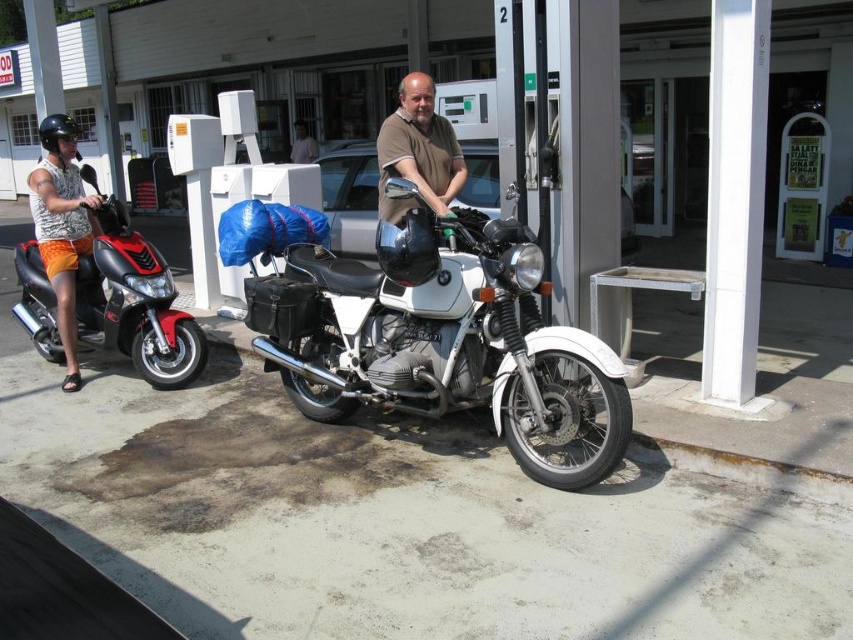
Question: Does shiny red scooter at left have a smaller size compared to brown matte shirt at center?

Choices:
 (A) yes
 (B) no

Answer: (B)

Question: Which is nearer to the light pink fabric shirt at center?

Choices:
 (A) white matte motorcycle at center
 (B) shiny red scooter at left

Answer: (B)

Question: Does brown matte shirt at center appear under light pink fabric shirt at center?

Choices:
 (A) yes
 (B) no

Answer: (A)

Question: Which object is closer to the camera taking this photo?

Choices:
 (A) brown matte shirt at center
 (B) orange shorts at left
 (C) light pink fabric shirt at center
 (D) white matte motorcycle at center

Answer: (D)

Question: Which of the following is the farthest from the observer?

Choices:
 (A) (392, 140)
 (B) (73, 353)
 (C) (171, 340)
 (D) (422, 364)

Answer: (B)

Question: Does shiny red scooter at left appear under light pink fabric shirt at center?

Choices:
 (A) no
 (B) yes

Answer: (B)